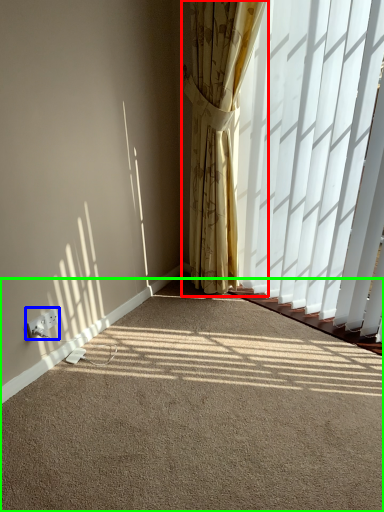
Question: Which object is positioned farthest from curtain (highlighted by a red box)? Select from electric outlet (highlighted by a blue box) and plain (highlighted by a green box).

Choices:
 (A) electric outlet
 (B) plain

Answer: (A)